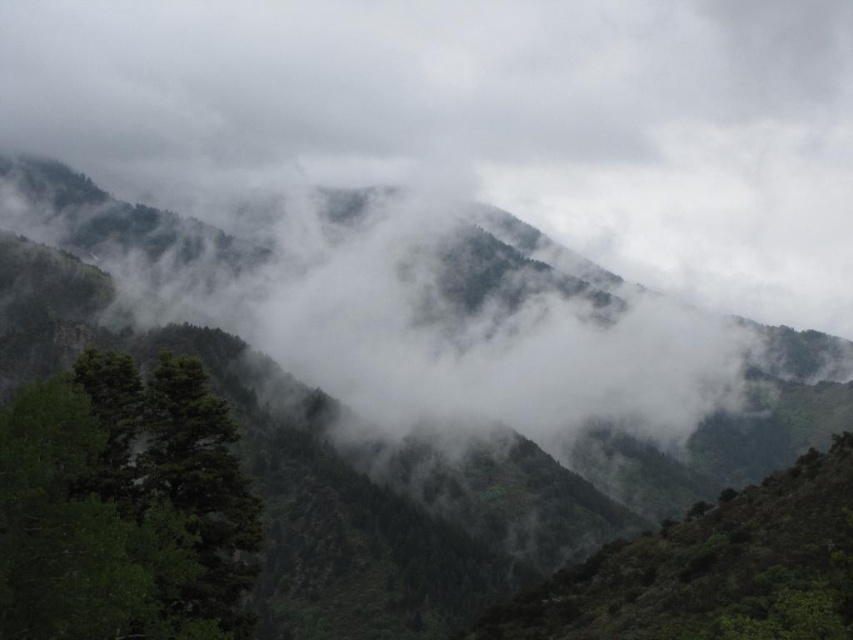
Is point (798, 67) in front of point (93, 449)?

No, (798, 67) is further to viewer.

Does white fluffy cloud at upper center appear on the right side of green matte tree at lower left?

Yes, white fluffy cloud at upper center is to the right of green matte tree at lower left.

This screenshot has height=640, width=853. In order to click on white fluffy cloud at upper center in this screenshot , I will do `click(480, 120)`.

Where is `white fluffy cloud at upper center`? This screenshot has width=853, height=640. white fluffy cloud at upper center is located at coordinates (480, 120).